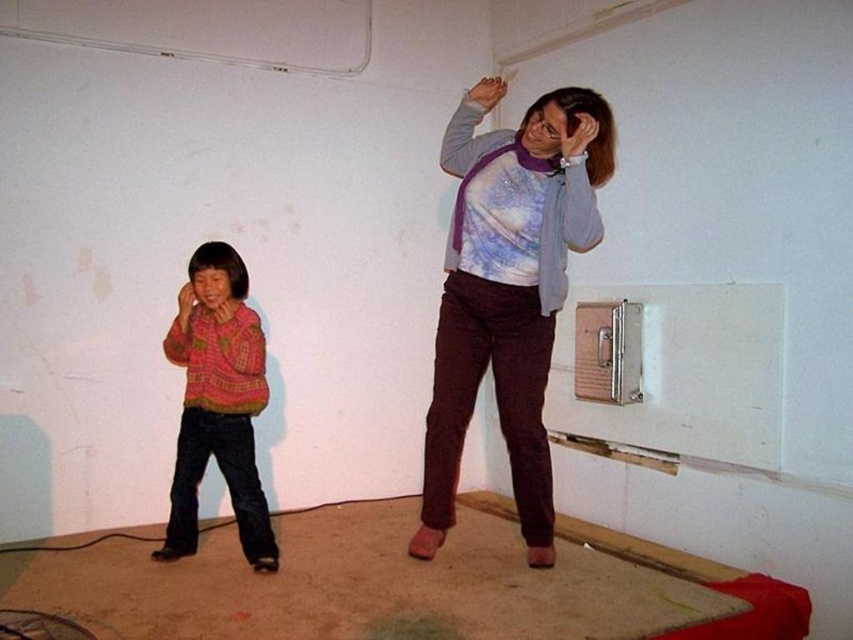
You are an interior designer planning to hang a new painting in the room. The purple soft scarf at upper center is currently hanging at coordinates point 0.453, 0.598. To avoid blocking the scarf, where should you position the painting?

The purple soft scarf at upper center is located at point (x=509, y=289). To avoid blocking it, the painting should be placed either to the left of the scarf at a coordinate less than 0.453 or to the right at a coordinate greater than 0.453 along the horizontal axis.